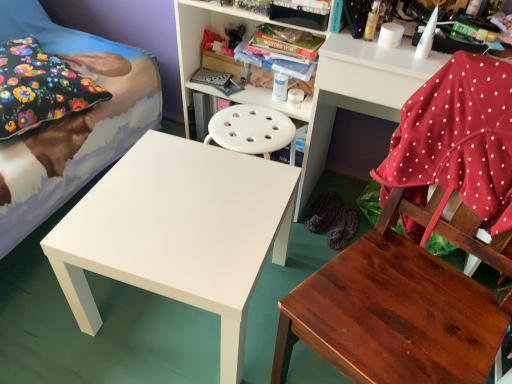
Question: Is wooden chair at lower right outside floral fabric pillow at upper left?

Choices:
 (A) yes
 (B) no

Answer: (A)

Question: Is wooden chair at lower right facing towards floral fabric pillow at upper left?

Choices:
 (A) yes
 (B) no

Answer: (B)

Question: Can you confirm if wooden chair at lower right is smaller than floral fabric pillow at upper left?

Choices:
 (A) no
 (B) yes

Answer: (A)

Question: Is wooden chair at lower right at the right side of floral fabric pillow at upper left?

Choices:
 (A) no
 (B) yes

Answer: (B)

Question: Is wooden chair at lower right behind floral fabric pillow at upper left?

Choices:
 (A) no
 (B) yes

Answer: (A)

Question: Is wooden chair at lower right to the left or to the right of white plastic shelf at upper right, which appears as the 2th shelf when viewed from the left, in the image?

Choices:
 (A) right
 (B) left

Answer: (B)

Question: Looking at the image, does wooden chair at lower right seem bigger or smaller compared to white plastic shelf at upper right, which appears as the 2th shelf when viewed from the left?

Choices:
 (A) big
 (B) small

Answer: (A)

Question: In the image, is wooden chair at lower right positioned in front of or behind white plastic shelf at upper right, which appears as the 2th shelf when viewed from the left?

Choices:
 (A) front
 (B) behind

Answer: (A)

Question: From a real-world perspective, is wooden chair at lower right physically located above or below white plastic shelf at upper right, arranged as the first shelf when viewed from the right?

Choices:
 (A) above
 (B) below

Answer: (A)

Question: From a real-world perspective, is floral fabric pillow at upper left above or below white matte table at center?

Choices:
 (A) below
 (B) above

Answer: (B)

Question: Considering the positions of point (38, 59) and point (245, 168), is point (38, 59) closer or farther from the camera than point (245, 168)?

Choices:
 (A) farther
 (B) closer

Answer: (A)

Question: From the image's perspective, is floral fabric pillow at upper left positioned above or below white matte table at center?

Choices:
 (A) below
 (B) above

Answer: (B)

Question: Is floral fabric pillow at upper left to the left or to the right of white matte table at center in the image?

Choices:
 (A) left
 (B) right

Answer: (A)

Question: Visually, is floral fabric pillow at upper left positioned to the left or to the right of white plastic shelf at upper center, positioned as the 2th shelf in right-to-left order?

Choices:
 (A) left
 (B) right

Answer: (A)

Question: From the image's perspective, is floral fabric pillow at upper left located above or below white plastic shelf at upper center, the first shelf when ordered from left to right?

Choices:
 (A) below
 (B) above

Answer: (A)